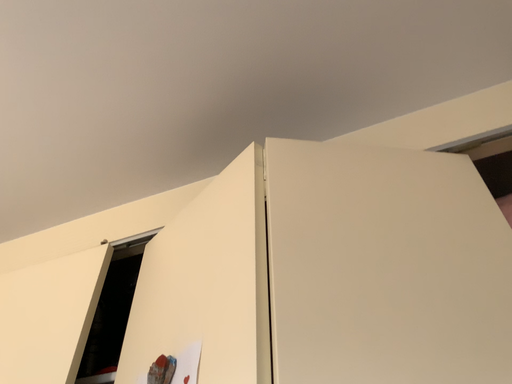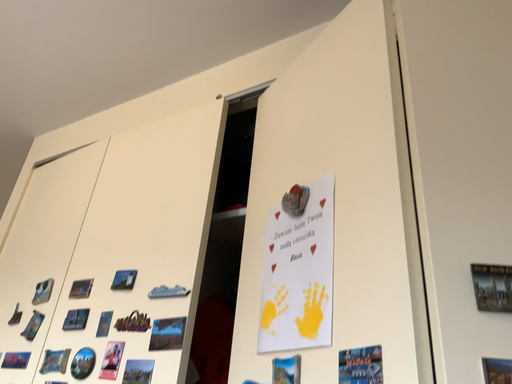
Question: How did the camera likely rotate when shooting the video?

Choices:
 (A) rotated downward
 (B) rotated upward

Answer: (A)